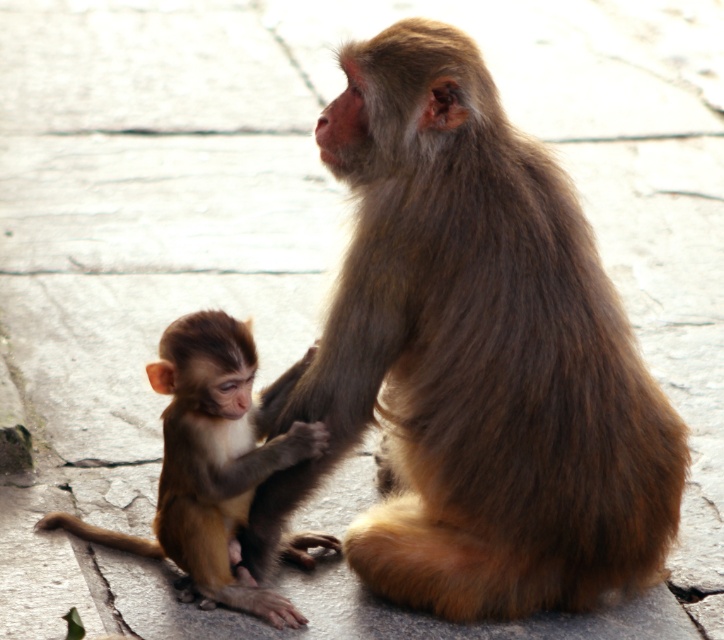
You are a wildlife photographer with a camera that can capture subjects within a 30 cm range. You want to take a closeup photo of both the brown furry monkey at center and the brown furry monkey at lower left. Can you position yourself so that both monkeys are within the camera range?

The distance between the brown furry monkey at center and the brown furry monkey at lower left is 26.46 centimeters. Since your camera can capture subjects within a 30 cm range, positioning yourself between them would ensure both are within the 30 cm range, allowing you to capture both monkeys in the closeup photo.

You are a wildlife photographer trying to capture a closeup shot of the brown furry monkey at center and the brown furry monkey at lower left. Since you want to ensure both are in focus, you need to know their sizes. Which monkey is larger?

The brown furry monkey at center is bigger than the brown furry monkey at lower left, so the center monkey is larger and will require more focus adjustment.